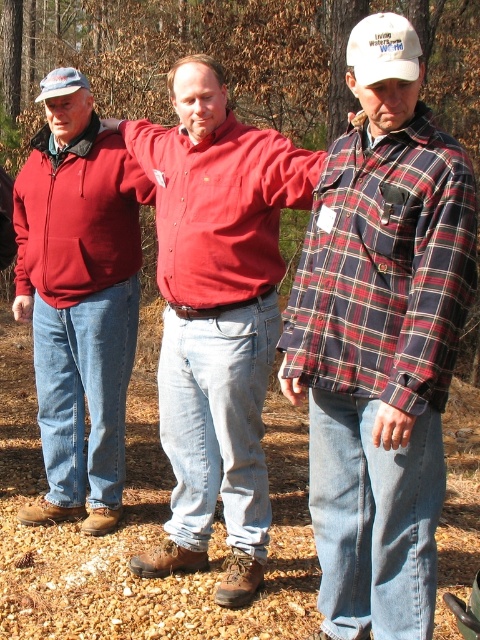
You are trying to locate the plaid flannel shirt at right in the wooded area. Based on the coordinates provided, where would you find it relative to the other people?

The plaid flannel shirt at right is located at point 0.556 on the x axis and 0.794 on the y axis, which places it to the right side of the scene and slightly lower in the image compared to the central figure and the person on the left.

You are a photographer trying to capture a group photo of the matte red shirt at center and the white cotton cap at upper right. To ensure both subjects are in frame, should you adjust your camera to focus more to the left or to the right?

The matte red shirt at center is to the left of the white cotton cap at upper right, so you should focus more to the right to include both subjects in the frame.

You are a photographer setting up a shot of the matte red shirt at center and the matte blue baseball cap at upper left. If your camera can only focus on objects within a 1.2 meter width, will both objects fit in the frame?

The matte red shirt at center might be wider than matte blue baseball cap at upper left, so it is uncertain whether both will fit within the 1.2 meter width. The photographer should check the actual width of both objects to confirm.